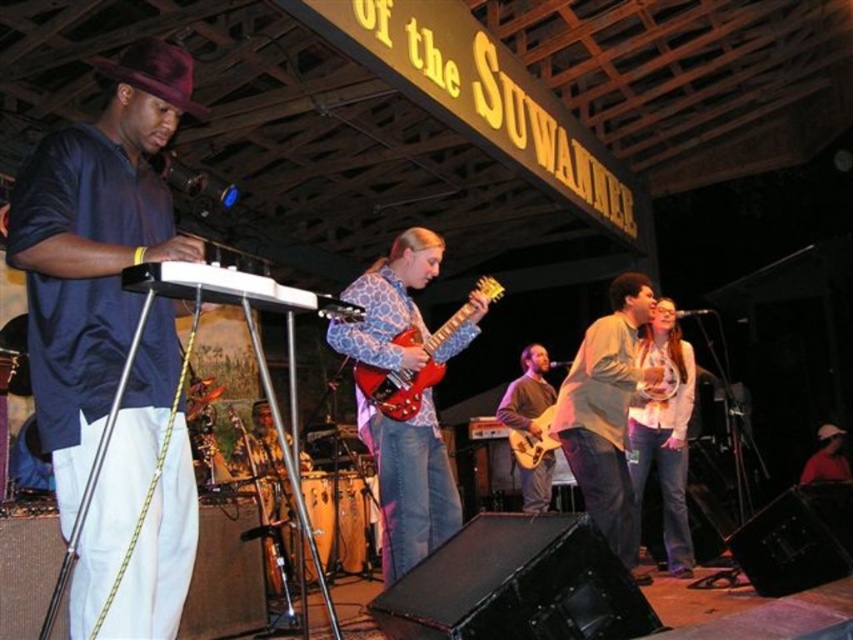
You are a photographer at the back of the venue and want to take a photo of the brown sweater at center and the white matte baseball cap at lower right. Which object is closer to the camera?

The brown sweater at center is closer to the camera because it is positioned over the white matte baseball cap at lower right.

You are sitting in the audience and want to know which of the two points, point [595,346] or point [509,438], is closer to you. Which one is closer?

Point [595,346] is closer to the viewer than point [509,438].